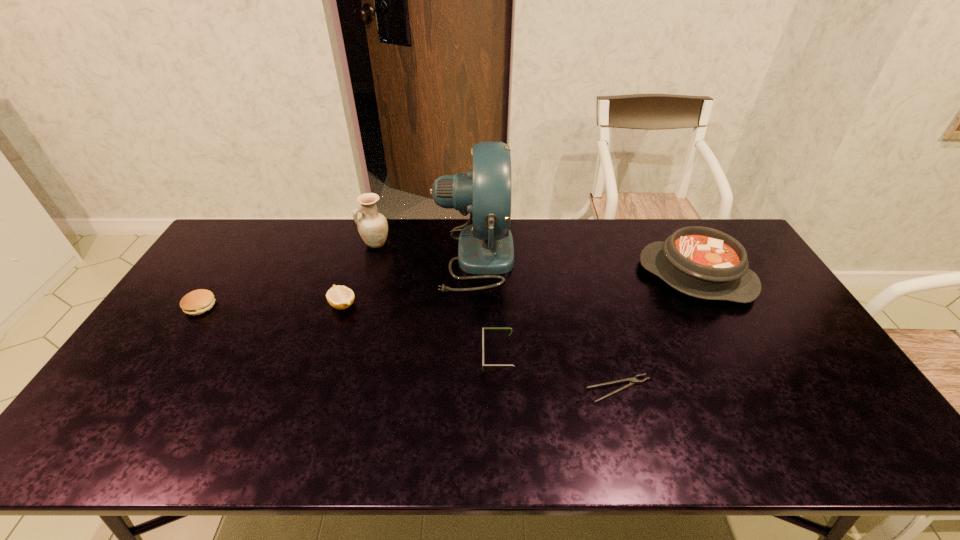
Where is `blank space located 0.400m on the left of the second tallest object`? The image size is (960, 540). blank space located 0.400m on the left of the second tallest object is located at coordinates (249, 243).

Find the location of a particular element. vacant space located 0.180m on the front of the casserole is located at coordinates (740, 358).

The image size is (960, 540). I want to click on vacant space situated on the back of the lemon, so click(362, 245).

Where is `vacant region located 0.370m on the back of the leftmost object`? This screenshot has height=540, width=960. vacant region located 0.370m on the back of the leftmost object is located at coordinates (252, 227).

Find the location of `free spot located 0.110m on the lens of the spectacles`. free spot located 0.110m on the lens of the spectacles is located at coordinates (442, 356).

What are the coordinates of `vacant area situated on the lens of the spectacles` in the screenshot? It's located at (420, 356).

Find the location of a particular element. Image resolution: width=960 pixels, height=540 pixels. free space located on the lens of the spectacles is located at coordinates (420, 356).

In order to click on vacant area situated 0.150m on the back of the tongs in this screenshot , I will do `click(603, 332)`.

The height and width of the screenshot is (540, 960). Find the location of `fan positioned at the far edge`. fan positioned at the far edge is located at coordinates (486, 248).

Find the location of `pottery that is at the far edge`. pottery that is at the far edge is located at coordinates (372, 226).